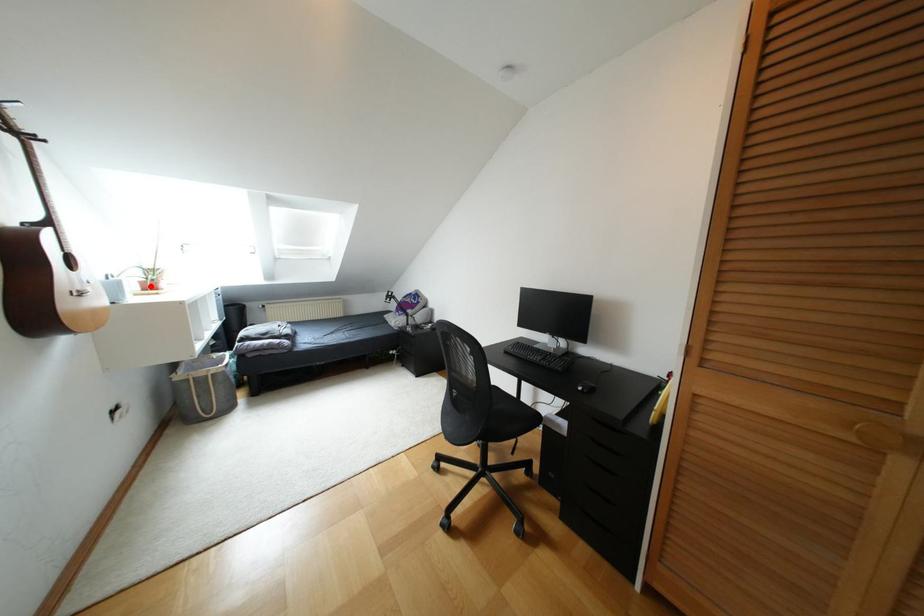
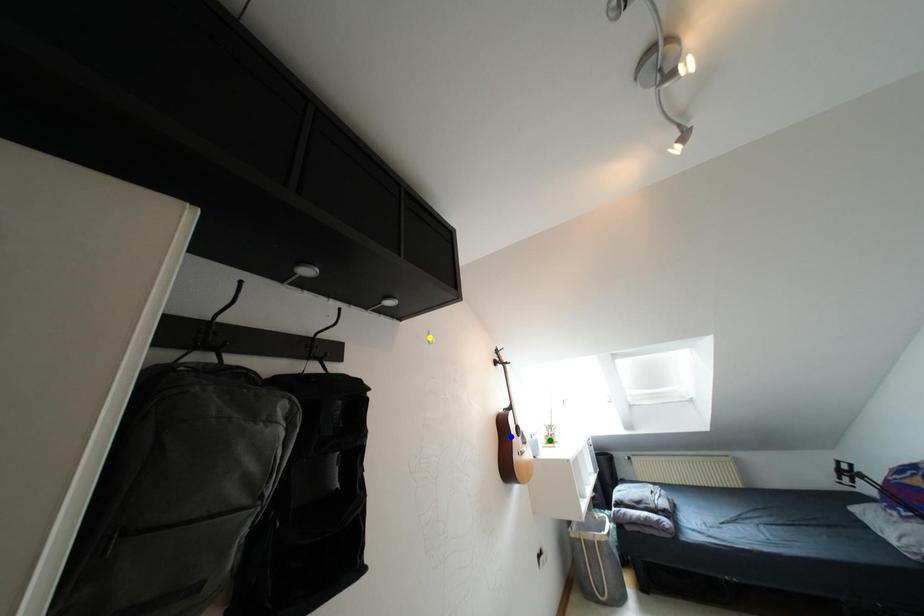
Question: I am providing you with two images of the same scene from different viewpoints. A red point is marked on the first image. You are given multiple points on the second image. Which mark in image 2 goes with the point in image 1?

Choices:
 (A) yellow point
 (B) green point
 (C) blue point

Answer: (B)